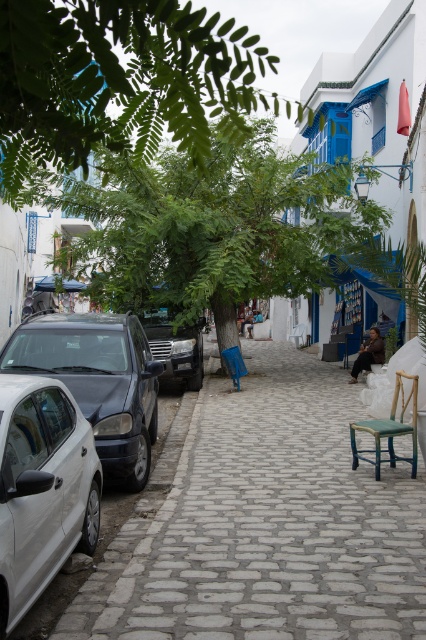
Question: Observing the image, what is the correct spatial positioning of white glossy car at left in reference to shiny black car at left?

Choices:
 (A) above
 (B) below

Answer: (B)

Question: Is white matte car at left thinner than teal wooden chair at center?

Choices:
 (A) no
 (B) yes

Answer: (B)

Question: Estimate the real-world distances between objects in this image. Which object is closer to the white matte car at left?

Choices:
 (A) green leafy tree at upper left
 (B) white glossy car at left
 (C) matte black car at center
 (D) green leafy tree at center

Answer: (B)

Question: Which object appears closest to the camera in this image?

Choices:
 (A) brown leather chair at center
 (B) green leafy tree at center
 (C) matte black car at center

Answer: (B)

Question: Which of the following is the farthest from the observer?

Choices:
 (A) (400, 380)
 (B) (238, 157)
 (C) (46, 540)

Answer: (B)

Question: Can you confirm if green leafy tree at upper left is positioned below shiny black car at left?

Choices:
 (A) yes
 (B) no

Answer: (B)